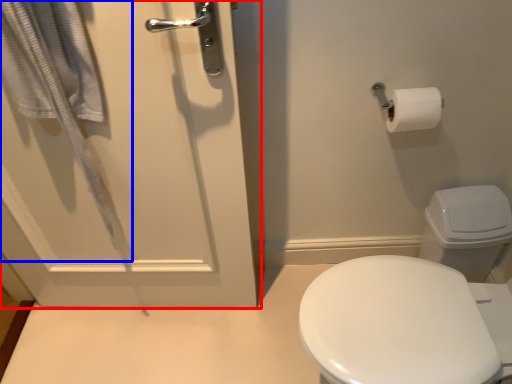
Question: Among these objects, which one is nearest to the camera, door (highlighted by a red box) or bath towel (highlighted by a blue box)?

Choices:
 (A) door
 (B) bath towel

Answer: (B)